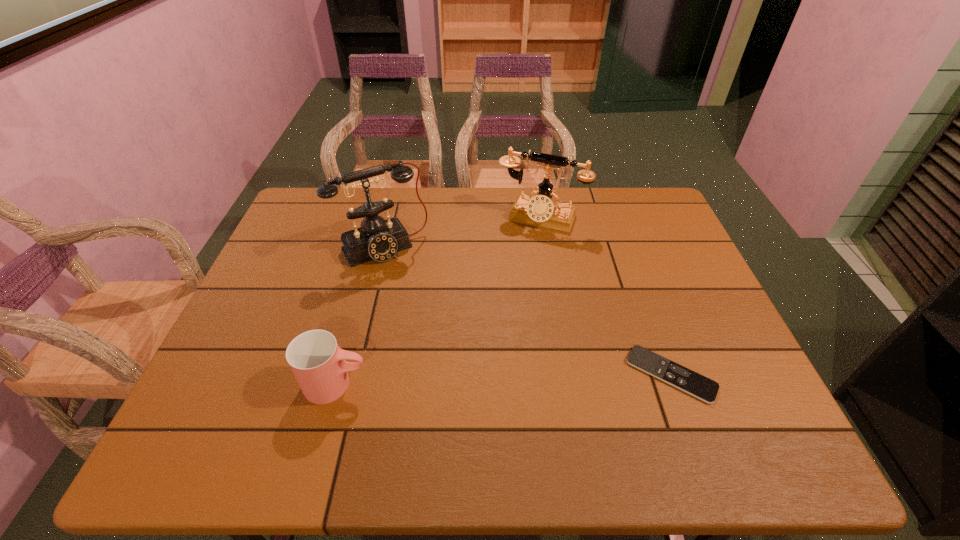
At what (x,y) coordinates should I click in order to perform the action: click on the third tallest object. Please return your answer as a coordinate pair (x, y). Looking at the image, I should click on (318, 363).

In order to click on the rightmost object in this screenshot , I will do `click(693, 383)`.

This screenshot has height=540, width=960. Find the location of `the shortest object`. the shortest object is located at coordinates (693, 383).

This screenshot has height=540, width=960. In order to click on the shorter telephone in this screenshot , I will do `click(541, 210)`.

At what (x,y) coordinates should I click in order to perform the action: click on the third object from left to right. Please return your answer as a coordinate pair (x, y). The width and height of the screenshot is (960, 540). Looking at the image, I should click on (541, 210).

The height and width of the screenshot is (540, 960). What are the coordinates of `the left telephone` in the screenshot? It's located at tap(377, 239).

Locate an element on the screen. The image size is (960, 540). vacant area situated 0.380m on the side of the second shortest object with the handle is located at coordinates (543, 384).

Where is `blank space located on the back of the shortest object`? The width and height of the screenshot is (960, 540). blank space located on the back of the shortest object is located at coordinates (628, 258).

Locate an element on the screen. The width and height of the screenshot is (960, 540). free spot located on the dial of the right telephone is located at coordinates (506, 280).

Locate an element on the screen. Image resolution: width=960 pixels, height=540 pixels. free space located 0.270m on the dial of the right telephone is located at coordinates (500, 292).